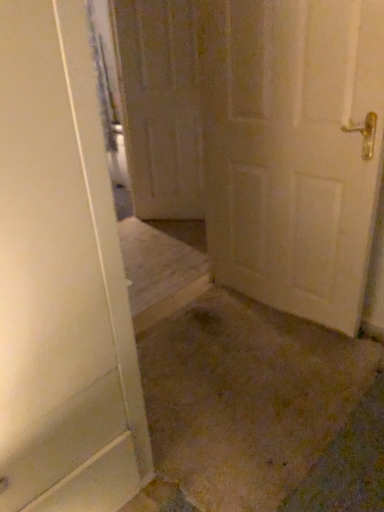
Question: In which direction should I rotate to look at white matte door at center, the 2th door when ordered from left to right?

Choices:
 (A) right
 (B) left

Answer: (A)

Question: From the image's perspective, is white matte door at center, placed as the 1th door when sorted from front to back, above wooden door at center, acting as the first door starting from the back?

Choices:
 (A) yes
 (B) no

Answer: (B)

Question: Is the position of white matte door at center, placed as the 1th door when sorted from front to back, more distant than that of wooden door at center, acting as the first door starting from the back?

Choices:
 (A) no
 (B) yes

Answer: (A)

Question: Is white matte door at center, the 2th door when ordered from left to right, smaller than wooden door at center, which is the first door from left to right?

Choices:
 (A) no
 (B) yes

Answer: (A)

Question: From a real-world perspective, is white matte door at center, placed as the 1th door when sorted from front to back, on top of wooden door at center, which is counted as the 2th door, starting from the front?

Choices:
 (A) yes
 (B) no

Answer: (B)

Question: Is white matte door at center, marked as the second door in a back-to-front arrangement, oriented away from wooden door at center, which is the first door from left to right?

Choices:
 (A) no
 (B) yes

Answer: (A)

Question: Can you confirm if white matte door at center, marked as the second door in a back-to-front arrangement, is bigger than wooden door at center, acting as the first door starting from the back?

Choices:
 (A) no
 (B) yes

Answer: (B)

Question: Considering the relative sizes of wooden door at center, marked as the 2th door in a right-to-left arrangement, and white matte door at center, the 2th door when ordered from left to right, in the image provided, is wooden door at center, marked as the 2th door in a right-to-left arrangement, thinner than white matte door at center, the 2th door when ordered from left to right,?

Choices:
 (A) yes
 (B) no

Answer: (A)

Question: Can you confirm if wooden door at center, which is counted as the 2th door, starting from the front, is bigger than white matte door at center, marked as the second door in a back-to-front arrangement?

Choices:
 (A) yes
 (B) no

Answer: (B)

Question: From a real-world perspective, is wooden door at center, which is the first door from left to right, over white matte door at center, arranged as the 1th door when viewed from the right?

Choices:
 (A) yes
 (B) no

Answer: (A)

Question: Is wooden door at center, which is counted as the 2th door, starting from the front, placed right next to white matte door at center, arranged as the 1th door when viewed from the right?

Choices:
 (A) yes
 (B) no

Answer: (B)

Question: Can you confirm if wooden door at center, which is the first door from left to right, is smaller than white matte door at center, placed as the 1th door when sorted from front to back?

Choices:
 (A) no
 (B) yes

Answer: (B)

Question: Is wooden door at center, marked as the 2th door in a right-to-left arrangement, oriented towards white matte door at center, marked as the second door in a back-to-front arrangement?

Choices:
 (A) yes
 (B) no

Answer: (B)

Question: From the image's perspective, is white matte door at center, marked as the second door in a back-to-front arrangement, located above or below wooden door at center, marked as the 2th door in a right-to-left arrangement?

Choices:
 (A) above
 (B) below

Answer: (B)